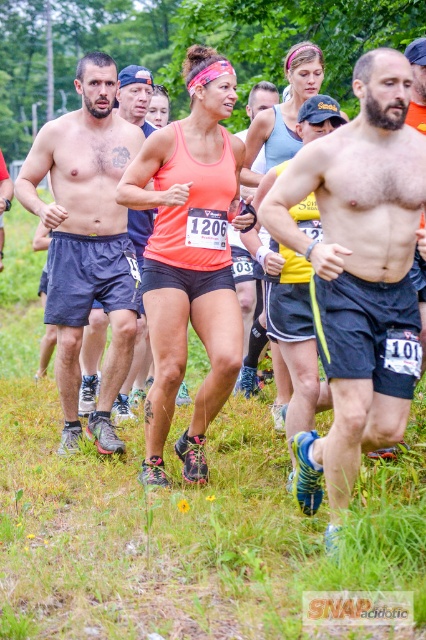
You are a photographer trying to capture a clear shot of the shiny blue shorts at center and the neon orange tank top at center. Which clothing item should you focus on if you want to photograph the one that is closer to the camera?

The shiny blue shorts at center has a lesser height compared to neon orange tank top at center, so the shiny blue shorts at center is closer to the camera and should be focused on.